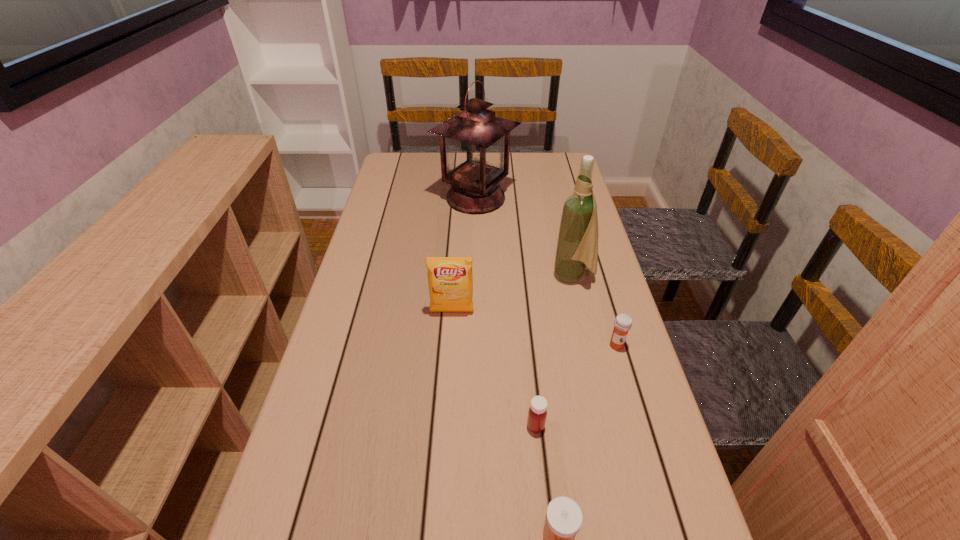
You are a GUI agent. You are given a task and a screenshot of the screen. Output one action in this format:
    pyautogui.click(x=<x>, y=<y>)
    Task: Click on the farthest object
    This screenshot has height=540, width=960.
    Given the screenshot: What is the action you would take?
    474,144

Find the location of a particular element. Image resolution: width=960 pixels, height=540 pixels. the second farthest object is located at coordinates (577, 246).

Find the location of a particular element. Image resolution: width=960 pixels, height=540 pixels. crisp (potato chip) is located at coordinates (450, 279).

Identify the location of the fourth shortest object. This screenshot has width=960, height=540. (450, 279).

You are a GUI agent. You are given a task and a screenshot of the screen. Output one action in this format:
    pyautogui.click(x=<x>, y=<y>)
    Task: Click on the farthest medicine
    Image resolution: width=960 pixels, height=540 pixels.
    Given the screenshot: What is the action you would take?
    pyautogui.click(x=623, y=322)

Image resolution: width=960 pixels, height=540 pixels. I want to click on the rightmost medicine, so coord(623,322).

Image resolution: width=960 pixels, height=540 pixels. Find the location of `the second nearest medicine`. the second nearest medicine is located at coordinates (537, 413).

Locate an element on the screen. This screenshot has width=960, height=540. free space located on the front of the farthest object is located at coordinates (475, 249).

Find the location of a particular element. This screenshot has width=960, height=540. vacant region located on the front-facing side of the wine bottle is located at coordinates (429, 276).

You are a GUI agent. You are given a task and a screenshot of the screen. Output one action in this format:
    pyautogui.click(x=<x>, y=<y>)
    Task: Click on the vacant point located on the front-facing side of the wine bottle
    The image size is (960, 540).
    Given the screenshot: What is the action you would take?
    pyautogui.click(x=412, y=276)